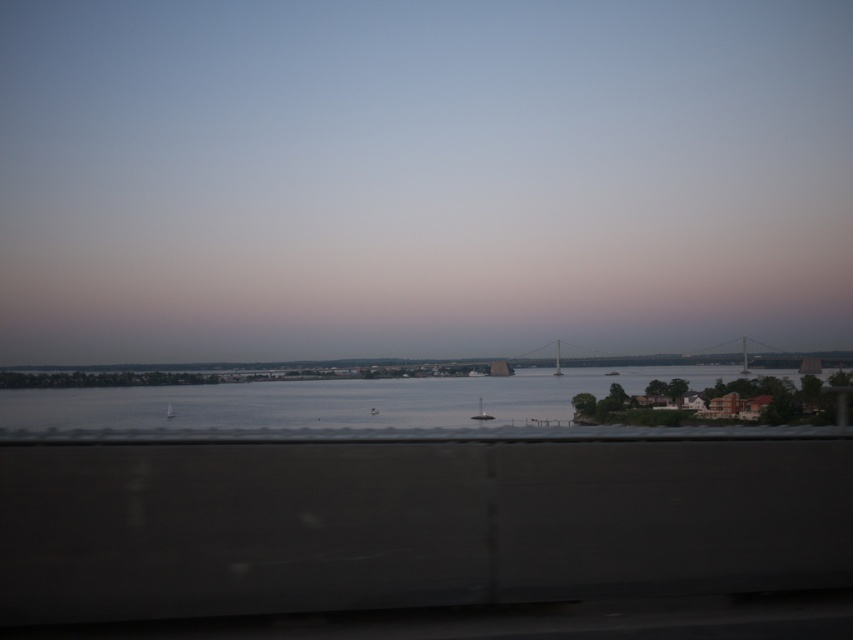
Which is more to the right, clear water at center or metallic gray bridge at center?

Positioned to the right is metallic gray bridge at center.

Does clear water at center appear on the right side of metallic gray bridge at center?

No, clear water at center is not to the right of metallic gray bridge at center.

Is point (328, 394) closer to viewer compared to point (527, 353)?

Yes, it is in front of point (527, 353).

This screenshot has height=640, width=853. What are the coordinates of `clear water at center` in the screenshot? It's located at (332, 401).